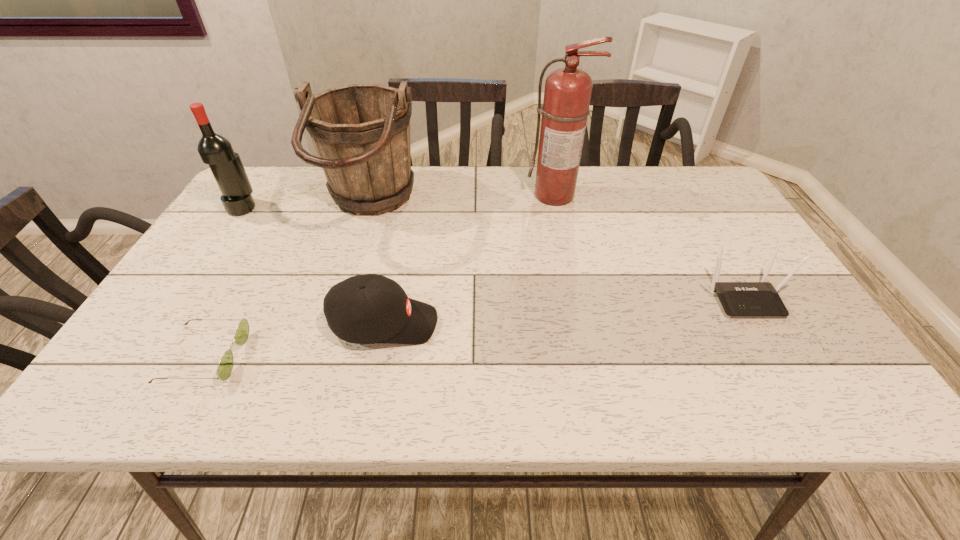
The height and width of the screenshot is (540, 960). I want to click on vacant area situated 0.120m on the front of the leftmost object, so click(x=218, y=244).

Find the location of a particular element. vacant space situated with a logo on the front of the baseball cap is located at coordinates (506, 323).

The height and width of the screenshot is (540, 960). Identify the location of free space located on the front-facing side of the router. (809, 409).

Identify the location of vacant space situated 0.310m on the front-facing side of the shortest object. The width and height of the screenshot is (960, 540). (390, 357).

Identify the location of fire extinguisher at the far edge. The width and height of the screenshot is (960, 540). (567, 94).

Image resolution: width=960 pixels, height=540 pixels. I want to click on bucket located at the far edge, so click(x=361, y=132).

At what (x,y) coordinates should I click in order to perform the action: click on wine bottle located in the far edge section of the desktop. Please return your answer as a coordinate pair (x, y). The height and width of the screenshot is (540, 960). Looking at the image, I should click on (215, 150).

The height and width of the screenshot is (540, 960). I want to click on object at the near edge, so click(x=225, y=367).

Locate an element on the screen. The image size is (960, 540). wine bottle located in the left edge section of the desktop is located at coordinates (215, 150).

Where is `sunglasses present at the left edge`? This screenshot has height=540, width=960. sunglasses present at the left edge is located at coordinates (225, 367).